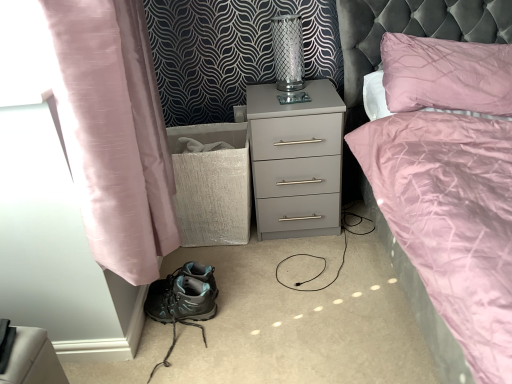
Identify the location of free space in front of matte gray nightstand at center. The height and width of the screenshot is (384, 512). (304, 269).